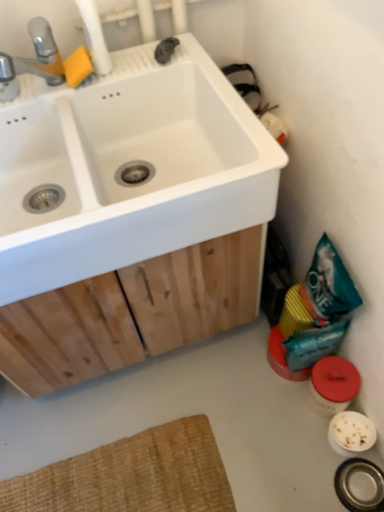
At what (x,y) coordinates should I click in order to perform the action: click on white matte sink at upper left. Please return your answer as a coordinate pair (x, y). Looking at the image, I should click on (126, 162).

This screenshot has width=384, height=512. What are the coordinates of `white matte sink at upper left` in the screenshot? It's located at (126, 162).

From a real-world perspective, is white matte sink at upper left beneath brushed metal faucet at upper left?

Correct, in the physical world, white matte sink at upper left is lower than brushed metal faucet at upper left.

Is white matte sink at upper left with brushed metal faucet at upper left?

white matte sink at upper left and brushed metal faucet at upper left are not in contact.

Which is closer to the camera, (226, 145) or (49, 53)?

Point (226, 145).

Where is `garbage located underneath the brushed metal faucet at upper left (from a real-world perspective)`? garbage located underneath the brushed metal faucet at upper left (from a real-world perspective) is located at coordinates (314, 314).

Is point (4, 76) closer or farther from the camera than point (322, 355)?

Point (4, 76) is closer to the camera than point (322, 355).

Looking at their sizes, would you say brushed metal faucet at upper left is wider or thinner than teal matte bag at lower right?

brushed metal faucet at upper left is wider than teal matte bag at lower right.

Are teal matte bag at lower right and white matte sink at upper left making contact?

No, teal matte bag at lower right is not making contact with white matte sink at upper left.

Between teal matte bag at lower right and white matte sink at upper left, which one appears on the right side from the viewer's perspective?

teal matte bag at lower right.

Does teal matte bag at lower right have a larger size compared to white matte sink at upper left?

No, teal matte bag at lower right is not bigger than white matte sink at upper left.

From the image's perspective, would you say teal matte bag at lower right is positioned over white matte sink at upper left?

No, from the image's perspective, teal matte bag at lower right is not on top of white matte sink at upper left.

How far apart are brushed metal faucet at upper left and white matte sink at upper left?

The distance of brushed metal faucet at upper left from white matte sink at upper left is 12.07 inches.

Can you confirm if brushed metal faucet at upper left is thinner than white matte sink at upper left?

Yes, brushed metal faucet at upper left is thinner than white matte sink at upper left.

From the image's perspective, is brushed metal faucet at upper left below white matte sink at upper left?

No.

Which is farther, [9,76] or [1,124]?

Point [1,124]

How many degrees apart are the facing directions of white matte sink at upper left and teal matte bag at lower right?

The angular difference between white matte sink at upper left and teal matte bag at lower right is 93.4 degrees.

Is white matte sink at upper left looking in the opposite direction of teal matte bag at lower right?

That's not correct — white matte sink at upper left is not looking away from teal matte bag at lower right.

Identify the location of garbage below the white matte sink at upper left (from the image's perspective). The width and height of the screenshot is (384, 512). (314, 314).

From the image's perspective, is teal matte bag at lower right below brushed metal faucet at upper left?

Yes, from the image's perspective, teal matte bag at lower right is below brushed metal faucet at upper left.

Consider the image. Would you consider teal matte bag at lower right to be distant from brushed metal faucet at upper left?

No, there isn't a large distance between teal matte bag at lower right and brushed metal faucet at upper left.

Is teal matte bag at lower right shorter than brushed metal faucet at upper left?

No, teal matte bag at lower right is not shorter than brushed metal faucet at upper left.

Considering the relative positions of teal matte bag at lower right and brushed metal faucet at upper left in the image provided, is teal matte bag at lower right to the left of brushed metal faucet at upper left from the viewer's perspective?

In fact, teal matte bag at lower right is to the right of brushed metal faucet at upper left.

The width and height of the screenshot is (384, 512). In order to click on sink in front of the brushed metal faucet at upper left in this screenshot , I will do `click(126, 162)`.

At what (x,y) coordinates should I click in order to perform the action: click on tap above the teal matte bag at lower right (from a real-world perspective). Please return your answer as a coordinate pair (x, y). The height and width of the screenshot is (512, 384). Looking at the image, I should click on (36, 55).

Which object lies further to the anchor point white matte sink at upper left, teal matte bag at lower right or brushed metal faucet at upper left?

teal matte bag at lower right lies further to white matte sink at upper left than the other object.

When comparing their distances from brushed metal faucet at upper left, does white matte sink at upper left or teal matte bag at lower right seem further?

Based on the image, teal matte bag at lower right appears to be further to brushed metal faucet at upper left.

Which object lies nearer to the anchor point white matte sink at upper left, brushed metal faucet at upper left or teal matte bag at lower right?

brushed metal faucet at upper left.

When comparing their distances from brushed metal faucet at upper left, does teal matte bag at lower right or white matte sink at upper left seem further?

The object further to brushed metal faucet at upper left is teal matte bag at lower right.

From the image, which object appears to be farther from teal matte bag at lower right, white matte sink at upper left or brushed metal faucet at upper left?

brushed metal faucet at upper left is positioned further to the anchor teal matte bag at lower right.

From the image, which object appears to be nearer to teal matte bag at lower right, brushed metal faucet at upper left or white matte sink at upper left?

Among the two, white matte sink at upper left is located nearer to teal matte bag at lower right.

Find the location of a particular element. The width and height of the screenshot is (384, 512). sink located between brushed metal faucet at upper left and teal matte bag at lower right in the left-right direction is located at coordinates (126, 162).